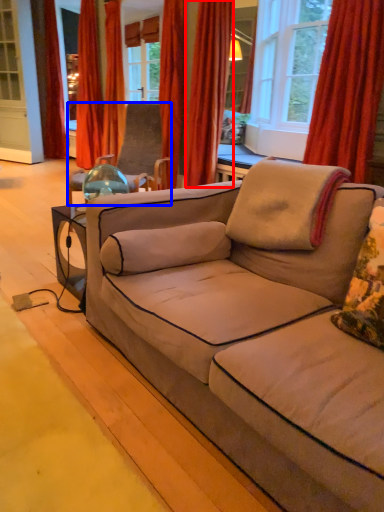
Question: Among these objects, which one is nearest to the camera, curtain (highlighted by a red box) or chair (highlighted by a blue box)?

Choices:
 (A) curtain
 (B) chair

Answer: (B)